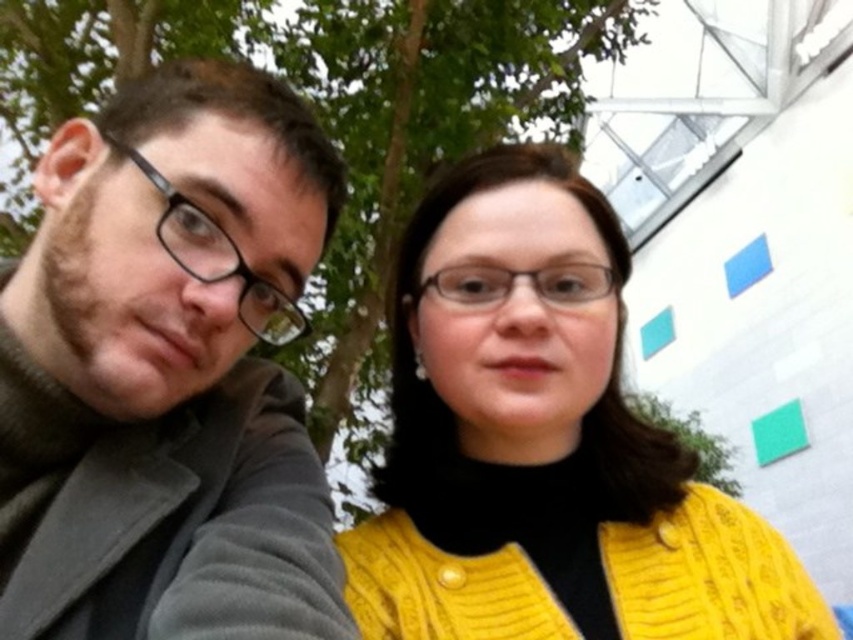
Is matte black jacket at left further to camera compared to black plastic glasses at left?

No.

Is matte black jacket at left wider than black plastic glasses at left?

Yes.

Is point (189, 628) positioned before point (190, 272)?

Yes.

Identify the location of matte black jacket at left. Image resolution: width=853 pixels, height=640 pixels. (167, 372).

Who is more distant from viewer, (x=424, y=621) or (x=213, y=227)?

The point (x=424, y=621) is more distant.

What do you see at coordinates (544, 451) in the screenshot? This screenshot has height=640, width=853. I see `yellow knitted sweater at center` at bounding box center [544, 451].

Is point (737, 625) closer to viewer compared to point (154, 173)?

No, it is not.

At what (x,y) coordinates should I click in order to perform the action: click on yellow knitted sweater at center. Please return your answer as a coordinate pair (x, y). This screenshot has width=853, height=640. Looking at the image, I should click on (544, 451).

Is black plastic glasses at left to the right of transparent plastic glasses at center from the viewer's perspective?

Incorrect, black plastic glasses at left is not on the right side of transparent plastic glasses at center.

Which is in front, point (259, 307) or point (479, 272)?

Point (259, 307)

Measure the distance between point (303,320) and camera.

Point (303,320) and camera are 1.09 meters apart.

You are a GUI agent. You are given a task and a screenshot of the screen. Output one action in this format:
    pyautogui.click(x=<x>, y=<y>)
    Task: Click on the black plastic glasses at left
    
    Given the screenshot: What is the action you would take?
    pyautogui.click(x=218, y=259)